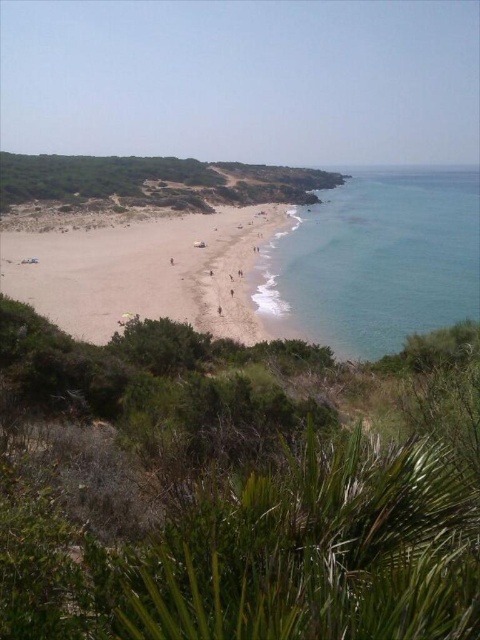
You are standing on the light brown sand at lower left and want to reach the clear blue water at right. Which direction should you walk to get closer to the water?

You should walk towards the right because the clear blue water at right is further to the viewer than the light brown sand at lower left, meaning it is closer to you.

You are planning to build a small sandcastle on the beach. Given the light brown sand at lower left and the clear blue water at right, which area would be more suitable for building a sandcastle and why?

The light brown sand at lower left is more suitable for building a sandcastle because the clear blue water at right is wider than the sand area, leaving less space for construction.

You are planning to build a sandcastle on the beach. Which area would be more suitable for building a sandcastle, the clear blue water at right or the light brown sand at lower left, and why?

The light brown sand at lower left is more suitable for building a sandcastle because the clear blue water at right is larger in size and likely deeper, making it unsuitable for constructing sandcastles.